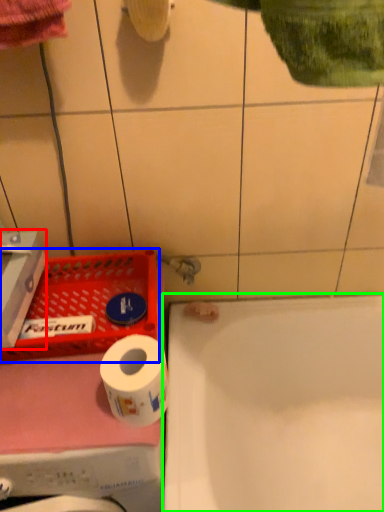
Question: Considering the real-world distances, which object is closest to carton (highlighted by a red box)? laundry basket (highlighted by a blue box) or bathtub (highlighted by a green box).

Choices:
 (A) laundry basket
 (B) bathtub

Answer: (A)